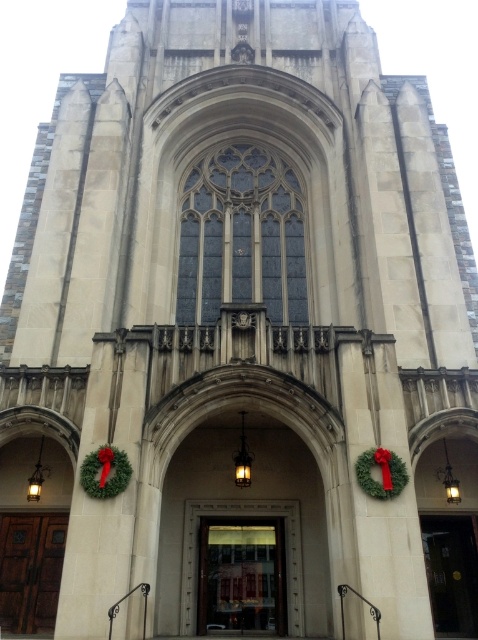
Question: Is wooden door at lower left above green matte wreath at lower center?

Choices:
 (A) no
 (B) yes

Answer: (A)

Question: Does green matte wreath at lower left appear on the right side of green matte wreath at lower center?

Choices:
 (A) no
 (B) yes

Answer: (A)

Question: Which of the following is the closest to the observer?

Choices:
 (A) matte brown door at center
 (B) wooden door at center

Answer: (B)

Question: Which of the following is the closest to the observer?

Choices:
 (A) (456, 518)
 (B) (209, 544)
 (C) (21, 605)

Answer: (C)

Question: Can you confirm if matte brown door at center is smaller than green matte wreath at lower left?

Choices:
 (A) no
 (B) yes

Answer: (A)

Question: Which of the following is the closest to the observer?

Choices:
 (A) matte brown door at center
 (B) green matte wreath at lower left
 (C) green matte wreath at lower center

Answer: (B)